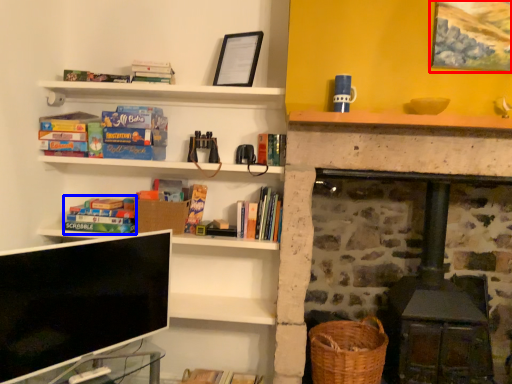
Question: Which of the following is the farthest to the observer, picture frame (highlighted by a red box) or book (highlighted by a blue box)?

Choices:
 (A) picture frame
 (B) book

Answer: (B)